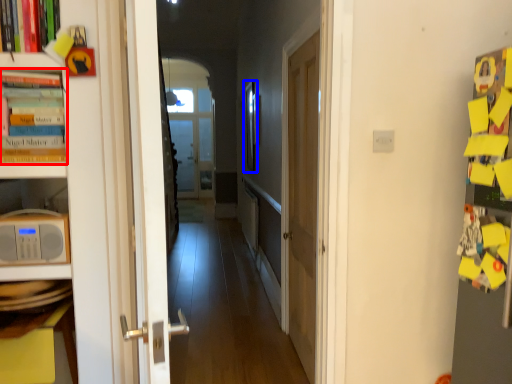
Question: Which of the following is the closest to the observer, book (highlighted by a red box) or picture frame (highlighted by a blue box)?

Choices:
 (A) book
 (B) picture frame

Answer: (A)